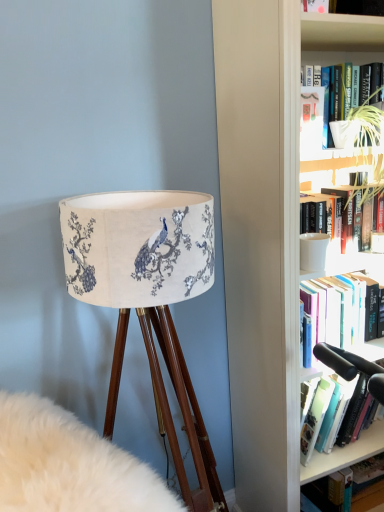
In order to face white matte mug at upper right, which appears as the second book when ordered from the bottom, should I rotate leftwards or rightwards?

To face it directly, rotate right by 18.200 degrees.

Where is `hardcover book at lower right, placed as the 2th book when sorted from top to bottom`? This screenshot has height=512, width=384. hardcover book at lower right, placed as the 2th book when sorted from top to bottom is located at coordinates (366, 477).

Where is `wooden tripod lamp at left`? The image size is (384, 512). wooden tripod lamp at left is located at coordinates (69, 464).

In order to click on white matte mug at upper right, marked as the 2th book in a back-to-front arrangement in this screenshot , I will do `click(340, 213)`.

How distant is wooden tripod lamp at left from hardcover book at lower right, placed as the 2th book when sorted from top to bottom?

They are 35.83 inches apart.

Who is taller, wooden tripod lamp at left or hardcover book at lower right, which appears as the first book when ordered from the bottom?

→ Standing taller between the two is wooden tripod lamp at left.

Is there a large distance between wooden tripod lamp at left and hardcover book at lower right, the 1th book viewed from the back?

No, wooden tripod lamp at left is in close proximity to hardcover book at lower right, the 1th book viewed from the back.

At what (x,y) coordinates should I click in order to perform the action: click on plain above the hardcover book at lower right, the second book in the front-to-back sequence (from the image's perspective). Please return your answer as a coordinate pair (x, y). This screenshot has width=384, height=512. Looking at the image, I should click on (69, 464).

How many degrees apart are the facing directions of white matte mug at upper right, positioned as the first book in top-to-bottom order, and matte white paperback book at upper right?

They differ by 11.3 degrees in their facing directions.

Is white matte mug at upper right, marked as the 2th book in a back-to-front arrangement, inside or outside of matte white paperback book at upper right?

white matte mug at upper right, marked as the 2th book in a back-to-front arrangement, is spatially situated outside matte white paperback book at upper right.

Between white matte mug at upper right, which is counted as the 1th book, starting from the front, and matte white paperback book at upper right, which one is positioned in front?

matte white paperback book at upper right is closer to the camera.

From a real-world perspective, who is located lower, white matte mug at upper right, which appears as the second book when ordered from the bottom, or matte white paperback book at upper right?

In real-world perspective, white matte mug at upper right, which appears as the second book when ordered from the bottom, is lower.

Considering the positions of objects hardcover book at lower right, which appears as the first book when ordered from the bottom, and matte fabric lampshade at left in the image provided, who is more to the left, hardcover book at lower right, which appears as the first book when ordered from the bottom, or matte fabric lampshade at left?

Positioned to the left is matte fabric lampshade at left.

Looking at this image, is hardcover book at lower right, the 1th book viewed from the back, inside the boundaries of matte fabric lampshade at left, or outside?

hardcover book at lower right, the 1th book viewed from the back, exists outside the volume of matte fabric lampshade at left.

Does hardcover book at lower right, placed as the 2th book when sorted from top to bottom, have a greater width compared to matte fabric lampshade at left?

Incorrect, the width of hardcover book at lower right, placed as the 2th book when sorted from top to bottom, does not surpass that of matte fabric lampshade at left.

In terms of size, does hardcover book at lower right, the 1th book viewed from the back, appear bigger or smaller than matte fabric lampshade at left?

Considering their sizes, hardcover book at lower right, the 1th book viewed from the back, takes up less space than matte fabric lampshade at left.

Which point is more distant from viewer, (161,345) or (364,476)?

The point (364,476) is farther.

How distant is matte fabric lampshade at left from hardcover book at lower right, the 1th book viewed from the back?

A distance of 34.27 inches exists between matte fabric lampshade at left and hardcover book at lower right, the 1th book viewed from the back.

From a real-world perspective, which object stands above the other?

matte fabric lampshade at left, from a real-world perspective.

Looking at their sizes, would you say white matte mug at upper right, which appears as the second book when ordered from the bottom, is wider or thinner than matte fabric lampshade at left?

In the image, white matte mug at upper right, which appears as the second book when ordered from the bottom, appears to be more narrow than matte fabric lampshade at left.

How far apart are white matte mug at upper right, which is counted as the 1th book, starting from the front, and matte fabric lampshade at left?

white matte mug at upper right, which is counted as the 1th book, starting from the front, is 21.50 inches from matte fabric lampshade at left.

From their relative heights in the image, would you say white matte mug at upper right, positioned as the first book in top-to-bottom order, is taller or shorter than matte fabric lampshade at left?

In the image, white matte mug at upper right, positioned as the first book in top-to-bottom order, appears to be shorter than matte fabric lampshade at left.

How different are the orientations of matte white paperback book at upper right and matte fabric lampshade at left in degrees?

They differ by 8.53 degrees in their facing directions.

Between matte white paperback book at upper right and matte fabric lampshade at left, which one has less height?

matte white paperback book at upper right.

Considering the relative positions of matte white paperback book at upper right and matte fabric lampshade at left in the image provided, is matte white paperback book at upper right behind matte fabric lampshade at left?

Yes, matte white paperback book at upper right is further from the viewer.

Which is nearer, (23, 506) or (318, 153)?

Point (23, 506).

Would you consider wooden tripod lamp at left to be distant from matte white paperback book at upper right?

No, wooden tripod lamp at left is in close proximity to matte white paperback book at upper right.

Where is `book located underneath the wooden tripod lamp at left (from a real-world perspective)`? The image size is (384, 512). book located underneath the wooden tripod lamp at left (from a real-world perspective) is located at coordinates (366, 477).

Identify the location of the 1st book below when counting from the matte white paperback book at upper right (from the image's perspective). (340, 213).

Considering their positions, is matte fabric lampshade at left positioned closer to wooden tripod lamp at left than matte white paperback book at upper right?

matte fabric lampshade at left is positioned closer to the anchor wooden tripod lamp at left.

Looking at the image, which one is located further to hardcover book at lower right, which appears as the first book when ordered from the bottom, white matte mug at upper right, marked as the 2th book in a back-to-front arrangement, or wooden tripod lamp at left?

Among the two, wooden tripod lamp at left is located further to hardcover book at lower right, which appears as the first book when ordered from the bottom.

When comparing their distances from matte fabric lampshade at left, does white matte mug at upper right, marked as the 2th book in a back-to-front arrangement, or hardcover book at lower right, which appears as the first book when ordered from the bottom, seem closer?

Based on the image, white matte mug at upper right, marked as the 2th book in a back-to-front arrangement, appears to be nearer to matte fabric lampshade at left.

Looking at the image, which one is located further to hardcover book at lower right, the second book in the front-to-back sequence, white matte mug at upper right, marked as the 2th book in a back-to-front arrangement, or matte fabric lampshade at left?

white matte mug at upper right, marked as the 2th book in a back-to-front arrangement.

Which object lies nearer to the anchor point matte fabric lampshade at left, wooden tripod lamp at left or hardcover book at lower right, the 1th book viewed from the back?

wooden tripod lamp at left is positioned closer to the anchor matte fabric lampshade at left.

Estimate the real-world distances between objects in this image. Which object is closer to matte white paperback book at upper right, white matte mug at upper right, which appears as the second book when ordered from the bottom, or hardcover book at lower right, which appears as the first book when ordered from the bottom?

Based on the image, white matte mug at upper right, which appears as the second book when ordered from the bottom, appears to be nearer to matte white paperback book at upper right.

Based on their spatial positions, is white matte mug at upper right, positioned as the first book in top-to-bottom order, or matte white paperback book at upper right further from wooden tripod lamp at left?

matte white paperback book at upper right lies further to wooden tripod lamp at left than the other object.

Considering their positions, is matte white paperback book at upper right positioned closer to matte fabric lampshade at left than hardcover book at lower right, the 1th book viewed from the back?

matte white paperback book at upper right.

This screenshot has height=512, width=384. What are the coordinates of `book that lies between matte white paperback book at upper right and wooden tripod lamp at left from top to bottom` in the screenshot? It's located at (340, 213).

Find the location of a particular element. book positioned between wooden tripod lamp at left and hardcover book at lower right, placed as the 2th book when sorted from top to bottom, from near to far is located at coordinates (340, 213).

You are a GUI agent. You are given a task and a screenshot of the screen. Output one action in this format:
    pyautogui.click(x=<x>, y=<y>)
    Task: Click on the lamp that lies between white matte mug at upper right, which is counted as the 1th book, starting from the front, and wooden tripod lamp at left from top to bottom
    
    Given the screenshot: What is the action you would take?
    pyautogui.click(x=148, y=298)

The width and height of the screenshot is (384, 512). I want to click on lamp between wooden tripod lamp at left and hardcover book at lower right, placed as the 2th book when sorted from top to bottom, in the front-back direction, so click(x=148, y=298).